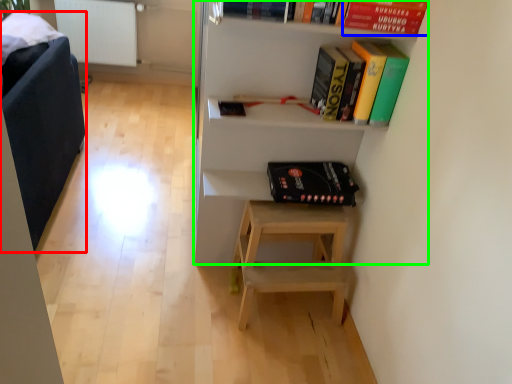
Question: Which object is positioned farthest from armchair (highlighted by a red box)? Select from paperback book (highlighted by a blue box) and shelf (highlighted by a green box).

Choices:
 (A) paperback book
 (B) shelf

Answer: (A)